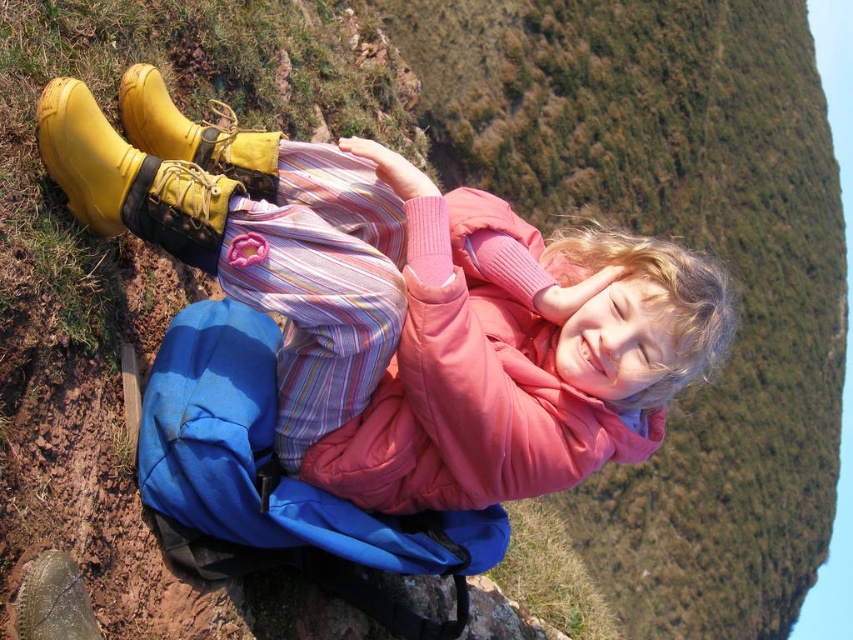
You are planning to take a nap in the blue quilted sleeping bag at center. Considering the yellow rubber boots at upper left are much taller than the sleeping bag, will they block your view when lying down?

The yellow rubber boots at upper left are much taller than the blue quilted sleeping bag at center, so they will block your view when lying down in the sleeping bag.